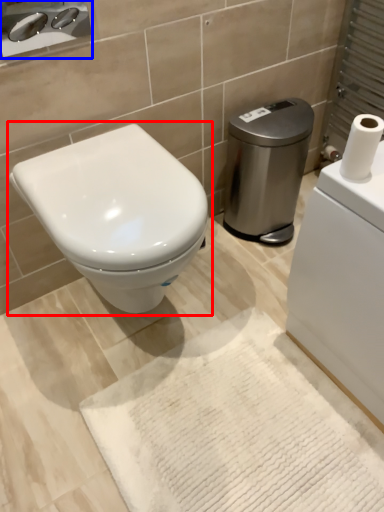
Question: Which of the following is the farthest to the observer, toilet (highlighted by a red box) or sink (highlighted by a blue box)?

Choices:
 (A) toilet
 (B) sink

Answer: (B)